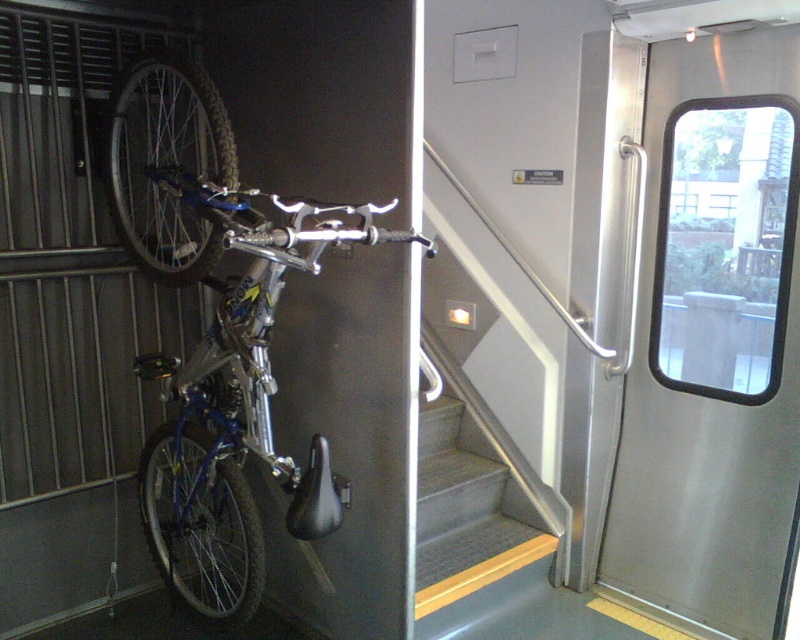
Question: Among these objects, which one is nearest to the camera?

Choices:
 (A) gray carpeted stairs at center
 (B) polished stainless steel door at right

Answer: (B)

Question: Can you confirm if polished stainless steel door at right is positioned to the right of gray carpeted stairs at center?

Choices:
 (A) no
 (B) yes

Answer: (B)

Question: Among these points, which one is farthest from the camera?

Choices:
 (A) (729, 557)
 (B) (433, 499)

Answer: (B)

Question: Where is polished stainless steel door at right located in relation to blue metallic bicycle at left in the image?

Choices:
 (A) left
 (B) right

Answer: (B)

Question: Among these objects, which one is farthest from the camera?

Choices:
 (A) polished stainless steel door at right
 (B) gray carpeted stairs at center
 (C) blue metallic bicycle at left

Answer: (B)

Question: Is polished stainless steel door at right to the left of blue metallic bicycle at left from the viewer's perspective?

Choices:
 (A) yes
 (B) no

Answer: (B)